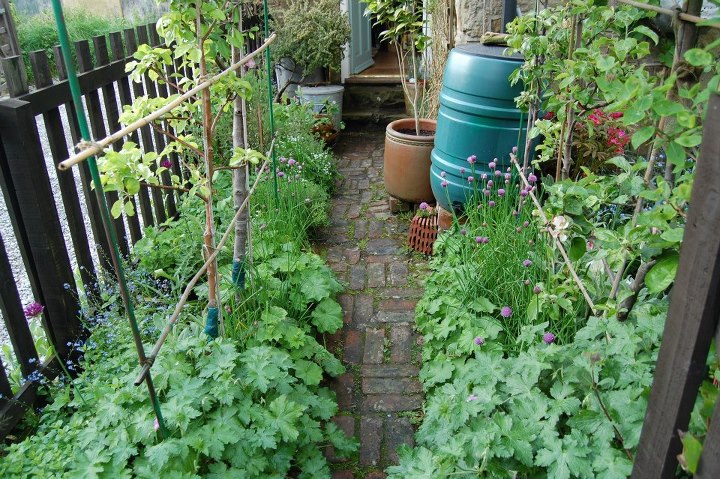
At what (x,y) coordinates should I click in order to perform the action: click on white flower pot. Please return your answer as a coordinate pair (x, y). Looking at the image, I should click on (320, 98).